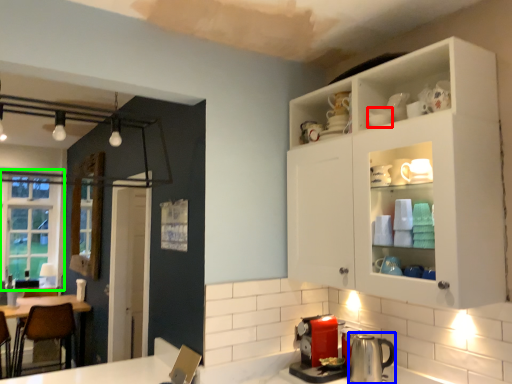
Question: Which object is the closest to the tableware (highlighted by a red box)? Choose among these: appliance (highlighted by a blue box) or window (highlighted by a green box).

Choices:
 (A) appliance
 (B) window

Answer: (A)